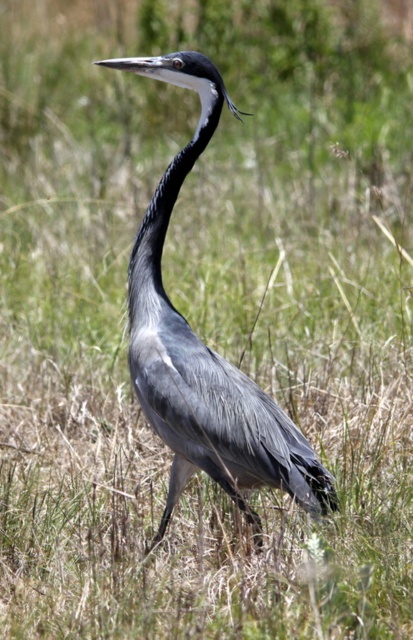
You are a birdwatcher observing the gray feathered heron at center and the smooth grey neck at center in the image. Which of these two is located to the left?

The smooth grey neck at center is located to the left of the gray feathered heron at center.

Looking at the image of the gray feathered heron at center and the smooth grey neck at center, which object is taller?

The gray feathered heron at center is much taller than the smooth grey neck at center.

You are a wildlife photographer aiming to capture the gray feathered heron at center and the smooth grey neck at center in a single frame. Based on their widths, which object should you adjust your camera focus on first to ensure both are in the frame?

The gray feathered heron at center is wider than the smooth grey neck at center. Therefore, you should focus on the gray feathered heron at center first to accommodate its larger width, ensuring both fit within the frame.